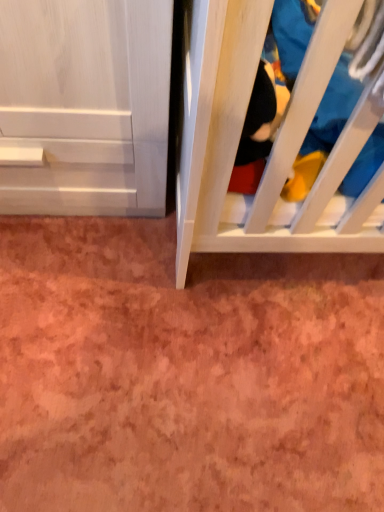
Question: From a real-world perspective, is wooden crib at right positioned under blue cotton shirt at right based on gravity?

Choices:
 (A) no
 (B) yes

Answer: (A)

Question: Considering the relative sizes of wooden crib at right and blue cotton shirt at right in the image provided, is wooden crib at right smaller than blue cotton shirt at right?

Choices:
 (A) no
 (B) yes

Answer: (B)

Question: From the image's perspective, is wooden crib at right over blue cotton shirt at right?

Choices:
 (A) no
 (B) yes

Answer: (A)

Question: Does wooden crib at right have a greater height compared to blue cotton shirt at right?

Choices:
 (A) no
 (B) yes

Answer: (B)

Question: Does wooden crib at right appear on the right side of blue cotton shirt at right?

Choices:
 (A) no
 (B) yes

Answer: (A)

Question: Could blue cotton shirt at right be considered to be inside wooden crib at right?

Choices:
 (A) yes
 (B) no

Answer: (B)

Question: Is blue cotton shirt at right shorter than wooden crib at right?

Choices:
 (A) yes
 (B) no

Answer: (A)

Question: Does blue cotton shirt at right have a greater height compared to wooden crib at right?

Choices:
 (A) no
 (B) yes

Answer: (A)

Question: Is wooden crib at right completely or partially inside blue cotton shirt at right?

Choices:
 (A) no
 (B) yes

Answer: (B)

Question: Is blue cotton shirt at right further to camera compared to wooden crib at right?

Choices:
 (A) yes
 (B) no

Answer: (A)

Question: Is blue cotton shirt at right wider than wooden crib at right?

Choices:
 (A) yes
 (B) no

Answer: (A)

Question: Does blue cotton shirt at right come in front of wooden crib at right?

Choices:
 (A) yes
 (B) no

Answer: (B)

Question: Do you think wooden crib at right is within blue cotton shirt at right, or outside of it?

Choices:
 (A) outside
 (B) inside

Answer: (B)